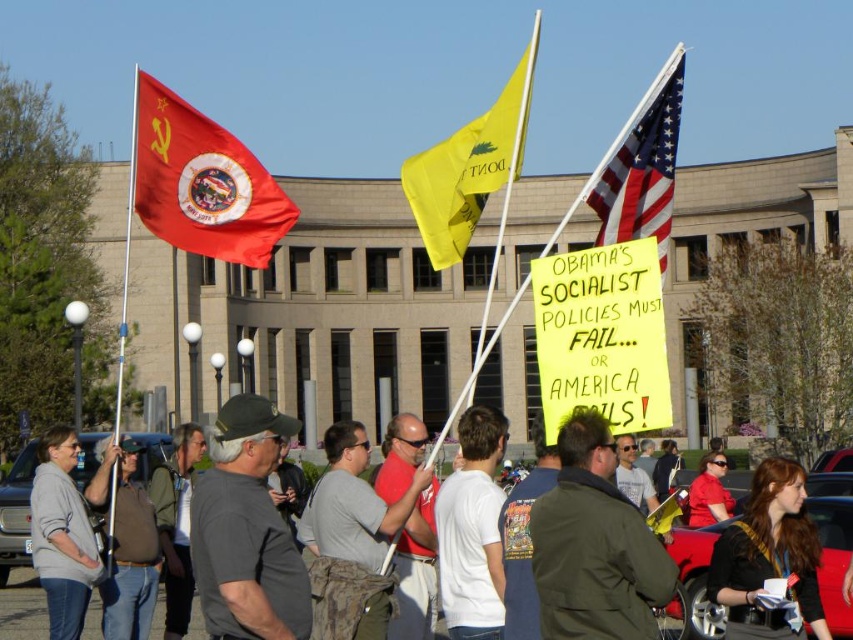
Question: Among these objects, which one is farthest from the camera?

Choices:
 (A) dark brown leather jacket at lower right
 (B) yellow fabric flag at center
 (C) red fabric flag at upper left
 (D) american flag at center

Answer: (A)

Question: Is dark brown leather jacket at lower right below american flag at center?

Choices:
 (A) yes
 (B) no

Answer: (A)

Question: Which point is farther to the camera?

Choices:
 (A) american flag at center
 (B) dark brown leather jacket at lower right
 (C) red fabric flag at upper left
 (D) yellow fabric flag at center

Answer: (B)

Question: Which point appears farthest from the camera in this image?

Choices:
 (A) (183, 209)
 (B) (422, 170)

Answer: (B)

Question: Does red fabric flag at upper left have a lesser width compared to yellow fabric flag at center?

Choices:
 (A) yes
 (B) no

Answer: (B)

Question: Considering the relative positions of dark brown leather jacket at lower right and yellow fabric flag at center in the image provided, where is dark brown leather jacket at lower right located with respect to yellow fabric flag at center?

Choices:
 (A) below
 (B) above

Answer: (A)